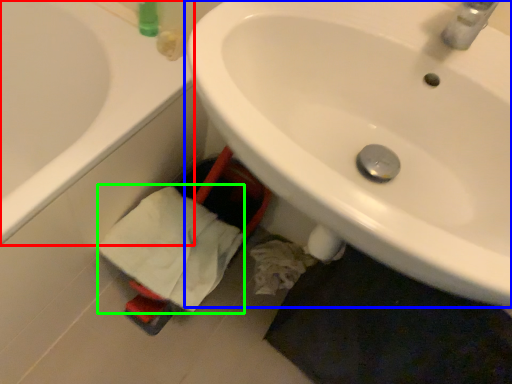
Question: Which object is the farthest from bathtub (highlighted by a red box)? Choose among these: sink (highlighted by a blue box) or bath towel (highlighted by a green box).

Choices:
 (A) sink
 (B) bath towel

Answer: (A)